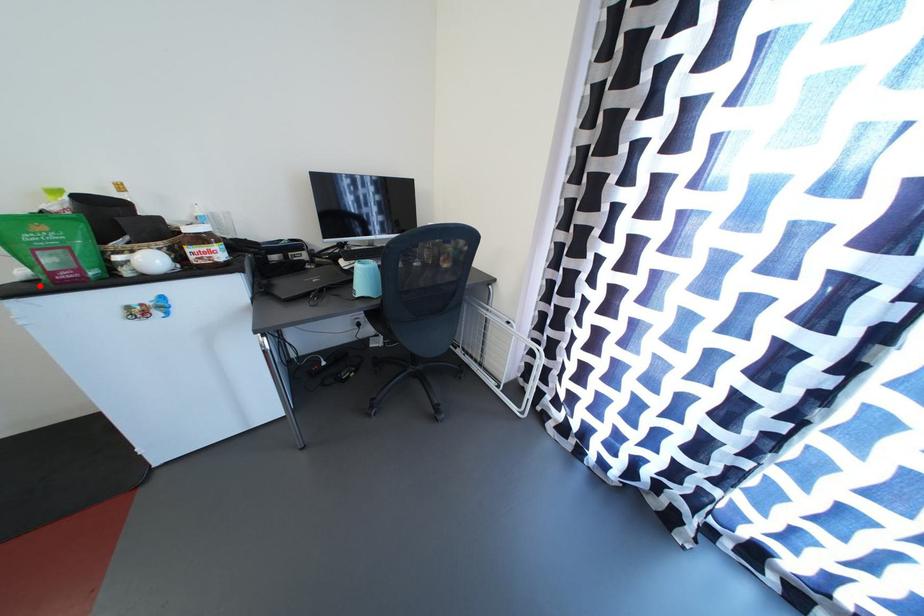
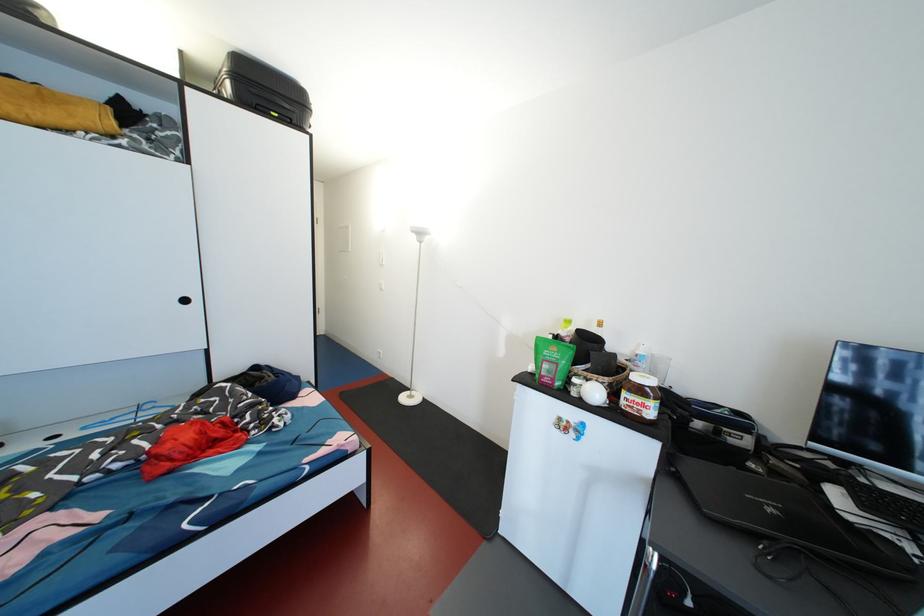
The point at the highlighted location is marked in the first image. Where is the corresponding point in the second image?

(539, 379)